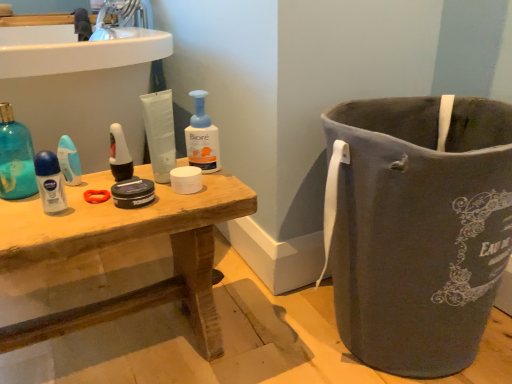
Identify the location of vacant space in front of blue plastic razor at center. (58, 209).